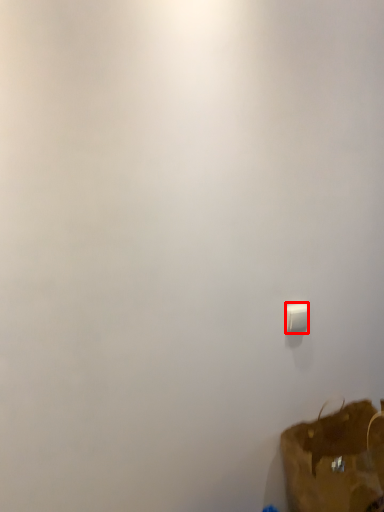
Question: From the image's perspective, where is light switch (annotated by the red box) located relative to luggage and bags?

Choices:
 (A) below
 (B) above

Answer: (B)